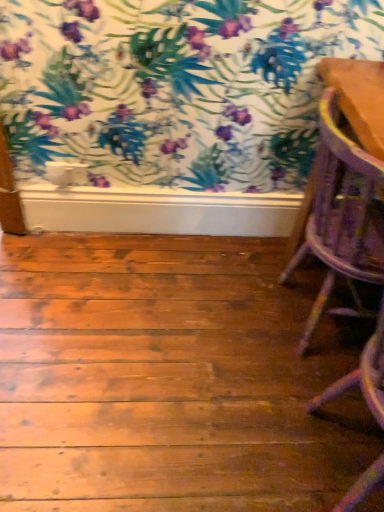
What do you see at coordinates (340, 214) in the screenshot? I see `wooden chair at right` at bounding box center [340, 214].

In order to face wooden chair at right, should I rotate leftwards or rightwards?

A 21.150 degree turn to the right will do.

Identify the location of wooden chair at right. This screenshot has width=384, height=512. (340, 214).

Image resolution: width=384 pixels, height=512 pixels. I want to click on wooden chair at right, so click(340, 214).